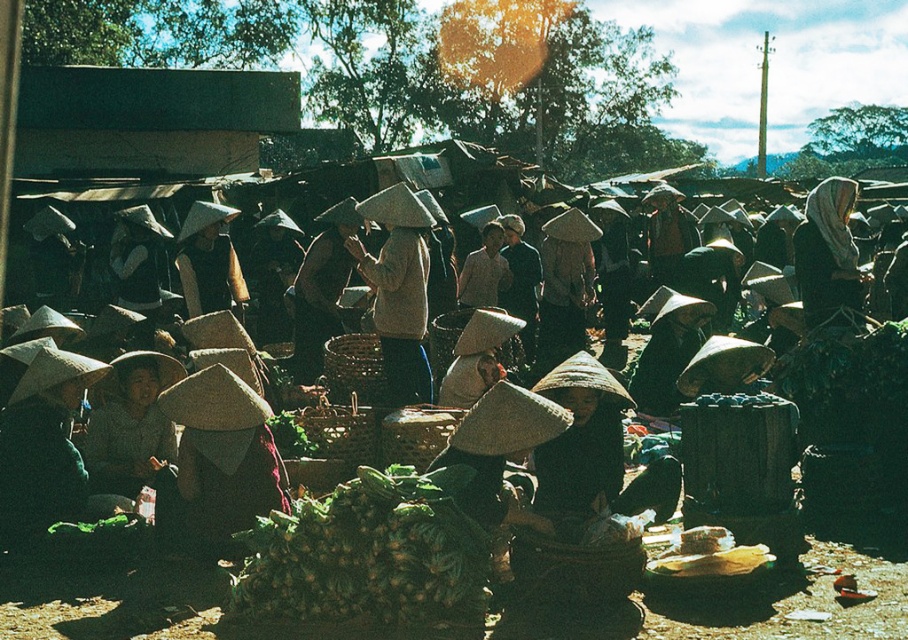
Consider the image. Can you confirm if matte beige hat at center is positioned below light beige fabric headscarf at center?

Yes.

Who is more distant from viewer, (391, 374) or (798, 227)?

Positioned behind is point (798, 227).

Describe the element at coordinates (398, 289) in the screenshot. I see `matte beige hat at center` at that location.

In order to click on matte beige hat at center in this screenshot , I will do `click(398, 289)`.

Can you confirm if green leafy vegetables at center is smaller than light beige fabric headscarf at center?

Yes, green leafy vegetables at center is smaller than light beige fabric headscarf at center.

Which is below, green leafy vegetables at center or light beige fabric headscarf at center?

Positioned lower is green leafy vegetables at center.

Who is more distant from viewer, [400,556] or [847,252]?

The point [847,252] is more distant.

Find the location of `green leafy vegetables at center`. green leafy vegetables at center is located at coordinates (368, 557).

Can you confirm if green leafy vegetables at center is wider than matte beige hat at center?

Yes.

The height and width of the screenshot is (640, 908). Describe the element at coordinates (368, 557) in the screenshot. I see `green leafy vegetables at center` at that location.

Find the location of a particular element. green leafy vegetables at center is located at coordinates (368, 557).